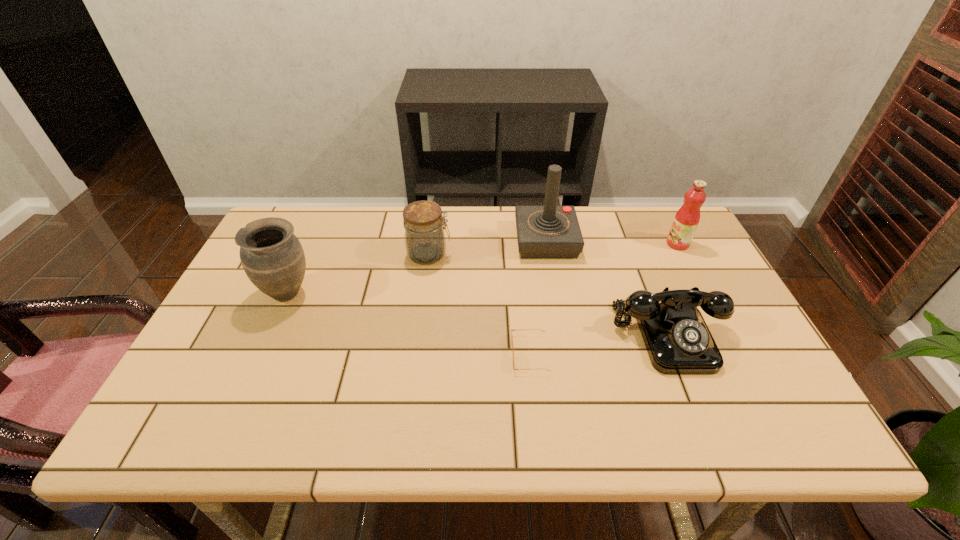
The height and width of the screenshot is (540, 960). Find the location of `vacant region located 0.350m on the front label of the fruit juice`. vacant region located 0.350m on the front label of the fruit juice is located at coordinates (552, 244).

Find the location of a particular element. vacant space situated on the front label of the fruit juice is located at coordinates (585, 244).

You are a GUI agent. You are given a task and a screenshot of the screen. Output one action in this format:
    pyautogui.click(x=<x>, y=<y>)
    Task: Click on the vacant point located on the front label of the fruit juice
    This screenshot has height=540, width=960.
    Given the screenshot: What is the action you would take?
    pyautogui.click(x=568, y=244)

You are a GUI agent. You are given a task and a screenshot of the screen. Output one action in this format:
    pyautogui.click(x=<x>, y=<y>)
    Task: Click on the free region located on the right of the leftmost object
    
    Given the screenshot: What is the action you would take?
    pyautogui.click(x=447, y=293)

Identify the location of vacant space positioned 0.260m on the lid of the third shortest object. This screenshot has height=540, width=960. (538, 254).

Where is `vacant region located on the dial of the fifth tallest object`? vacant region located on the dial of the fifth tallest object is located at coordinates (699, 410).

I want to click on blank space located 0.060m on the face of the sunglasses, so click(x=487, y=354).

This screenshot has height=540, width=960. Find the location of `free space located 0.380m on the face of the sunglasses`. free space located 0.380m on the face of the sunglasses is located at coordinates [352, 354].

The image size is (960, 540). I want to click on vacant position located on the face of the sunglasses, so click(x=444, y=354).

Where is `joystick located at the far edge`? The image size is (960, 540). joystick located at the far edge is located at coordinates (544, 232).